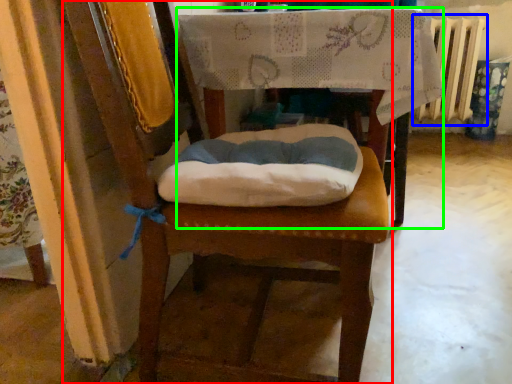
Question: Estimate the real-world distances between objects in this image. Which object is farther from chair (highlighted by a red box), radiator (highlighted by a blue box) or table (highlighted by a green box)?

Choices:
 (A) radiator
 (B) table

Answer: (A)